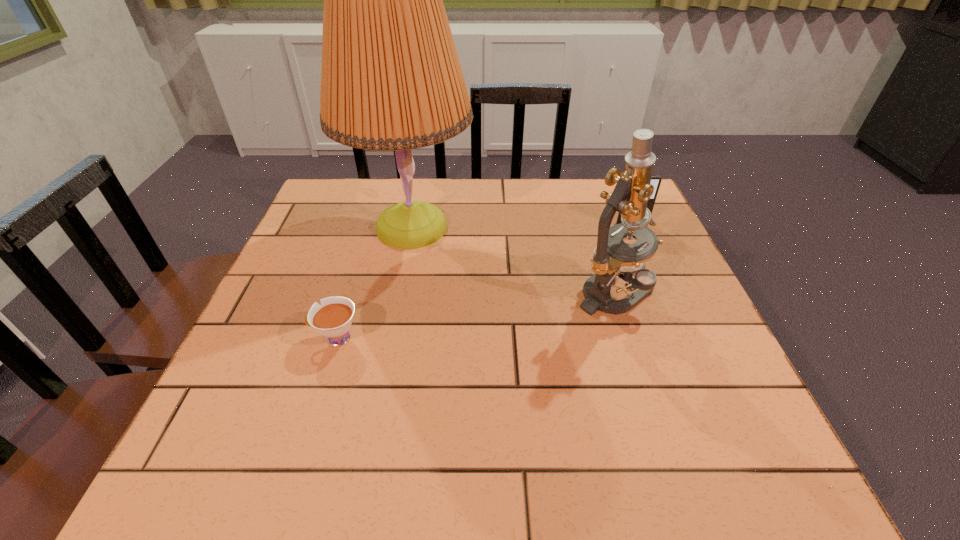
Where is `lamp`? The height and width of the screenshot is (540, 960). lamp is located at coordinates (391, 80).

The width and height of the screenshot is (960, 540). I want to click on the second tallest object, so click(x=612, y=256).

The height and width of the screenshot is (540, 960). I want to click on iPod, so click(x=656, y=180).

At what (x,y) coordinates should I click in order to perform the action: click on the shortest object. Please return your answer as a coordinate pair (x, y). The height and width of the screenshot is (540, 960). Looking at the image, I should click on (333, 318).

At what (x,y) coordinates should I click in order to perform the action: click on teacup. Please return your answer as a coordinate pair (x, y). Image resolution: width=960 pixels, height=540 pixels. Looking at the image, I should click on (333, 318).

Where is `vacant space located on the side of the lamp near the pull switch`? The width and height of the screenshot is (960, 540). vacant space located on the side of the lamp near the pull switch is located at coordinates (605, 228).

Where is `vacant area situated 0.110m on the left of the microscope`? vacant area situated 0.110m on the left of the microscope is located at coordinates (525, 292).

Find the location of `free space located 0.080m on the front-facing side of the second shortest object`. free space located 0.080m on the front-facing side of the second shortest object is located at coordinates (640, 245).

In order to click on free location located 0.110m on the side of the teacup with the handle in this screenshot , I will do `click(255, 338)`.

Identify the location of free spot located 0.100m on the side of the teacup with the handle. This screenshot has width=960, height=540. (261, 338).